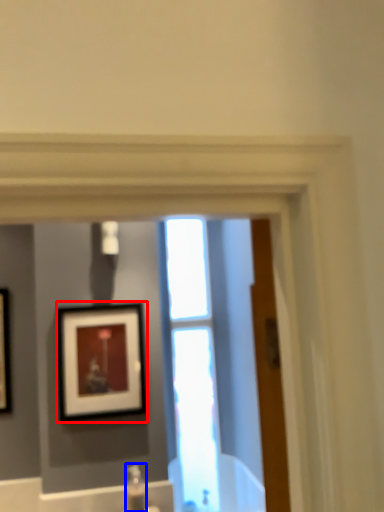
Question: Which point is closer to the camera, picture frame (highlighted by a red box) or plumbing fixture (highlighted by a blue box)?

Choices:
 (A) picture frame
 (B) plumbing fixture

Answer: (B)